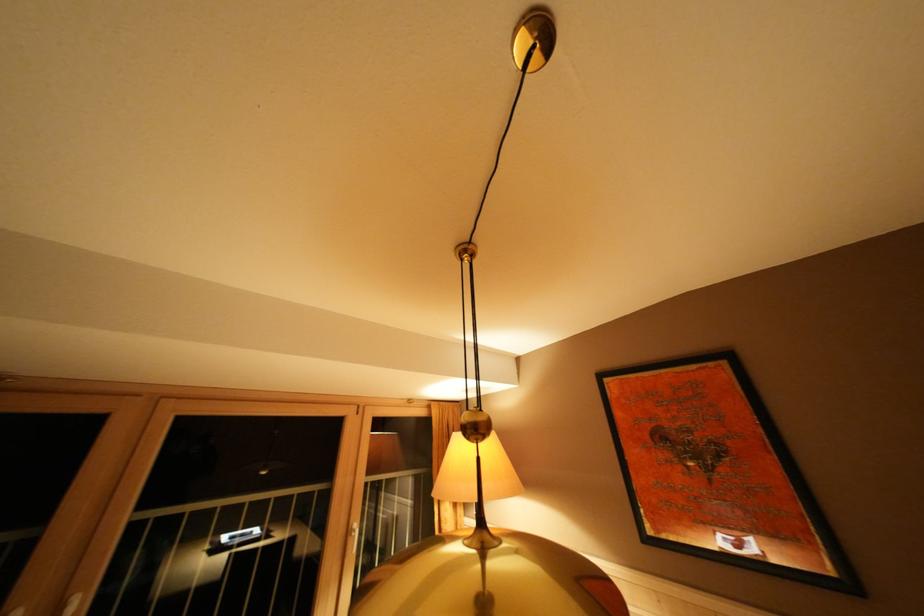
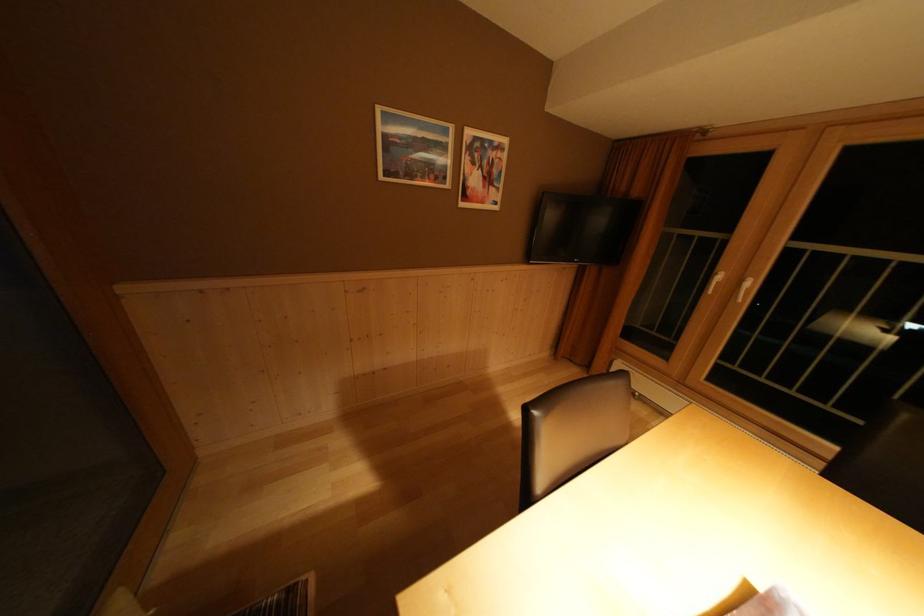
Based on the photo, based on the continuous images, in which direction is the camera rotating?

The rotation direction of the camera is left-down.